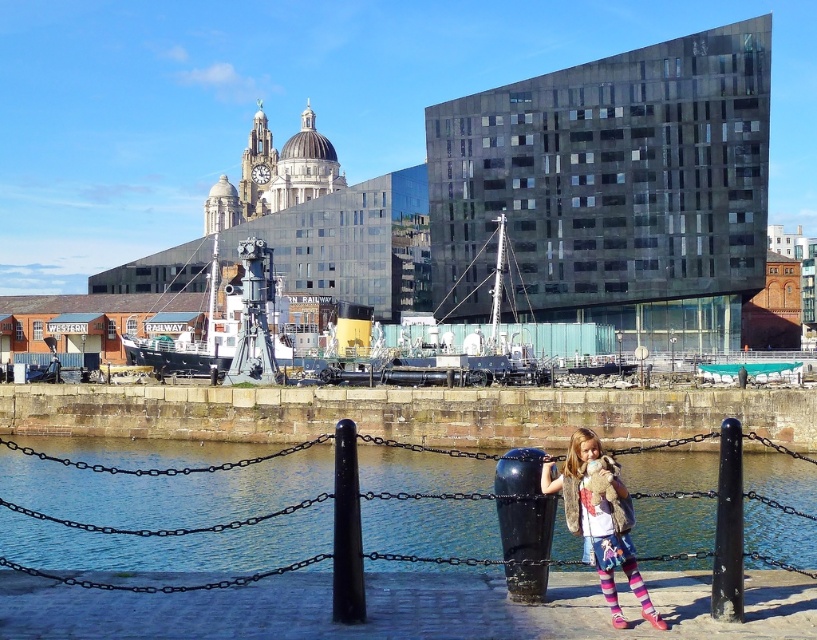
Consider the image. You are a photographer trying to capture the shipyard in the background. You see the light brown fur vest at lower right and the black smooth pole at center in your camera frame. Which object should you move to ensure the shipyard is fully visible?

You should move the light brown fur vest at lower right because it is positioned over the black smooth pole at center, blocking the view of the shipyard in the background.

A city planner is designing a new walkway extension that needs to connect the black smooth pole at center to another structure 41.71 meters away. If the current walkway is 30 meters long, how much longer does the walkway need to be extended to reach the structure?

The walkway needs to be extended by 11.71 meters to reach the structure, as the distance between the black smooth pole at center and the other structure is 41.71 meters, and the current walkway is only 30 meters long.

You are a delivery drone with a wingspan of 1.5 meters. You need to fly between the black smooth pole at center and the black matte pole at lower right. Can you safely navigate the space between them without touching either pole?

The distance between the black smooth pole at center and the black matte pole at lower right is 11.25 meters. Since your wingspan is only 1.5 meters, you have ample space to navigate safely between them.